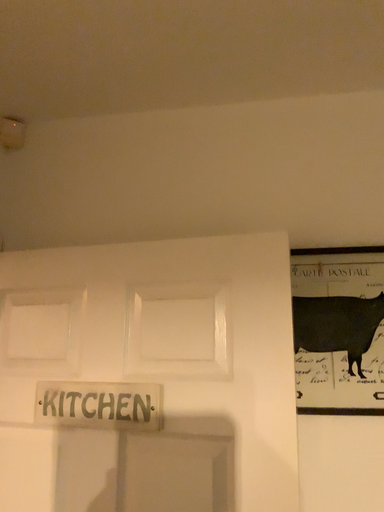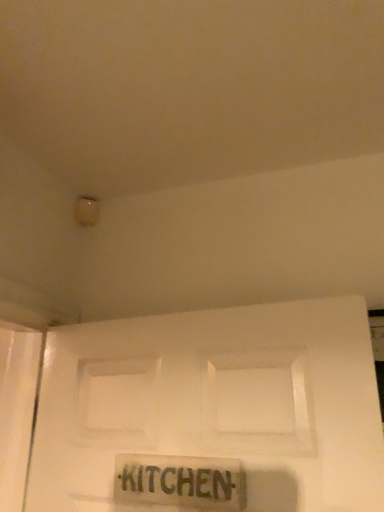
Question: Which way did the camera rotate in the video?

Choices:
 (A) rotated upward
 (B) rotated downward

Answer: (A)